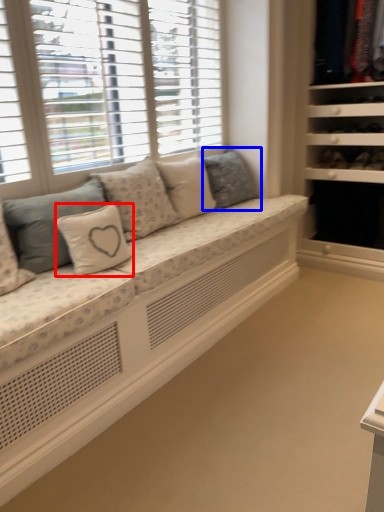
Question: Which object is further to the camera taking this photo, pillow (highlighted by a red box) or pillow (highlighted by a blue box)?

Choices:
 (A) pillow
 (B) pillow

Answer: (B)